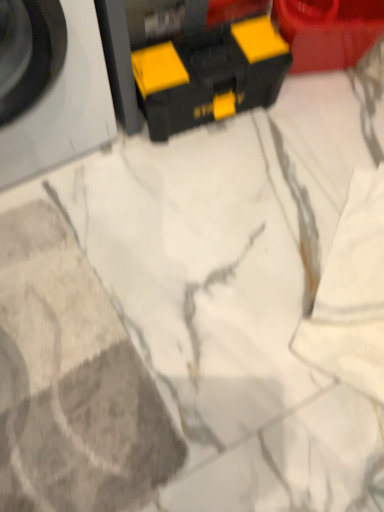
Question: From the image's perspective, is white matte washing machine at left located above or below black plastic toolbox at upper center?

Choices:
 (A) above
 (B) below

Answer: (A)

Question: From a real-world perspective, is white matte washing machine at left physically located above or below black plastic toolbox at upper center?

Choices:
 (A) below
 (B) above

Answer: (B)

Question: Considering the relative positions of white matte washing machine at left and black plastic toolbox at upper center in the image provided, is white matte washing machine at left to the left or to the right of black plastic toolbox at upper center?

Choices:
 (A) left
 (B) right

Answer: (A)

Question: From a real-world perspective, is black plastic toolbox at upper center positioned above or below white matte washing machine at left?

Choices:
 (A) below
 (B) above

Answer: (A)

Question: Is point (188, 80) positioned closer to the camera than point (82, 45)?

Choices:
 (A) farther
 (B) closer

Answer: (A)

Question: In the image, is black plastic toolbox at upper center positioned in front of or behind white matte washing machine at left?

Choices:
 (A) behind
 (B) front

Answer: (A)

Question: Considering the positions of black plastic toolbox at upper center and white matte washing machine at left in the image, is black plastic toolbox at upper center taller or shorter than white matte washing machine at left?

Choices:
 (A) short
 (B) tall

Answer: (A)